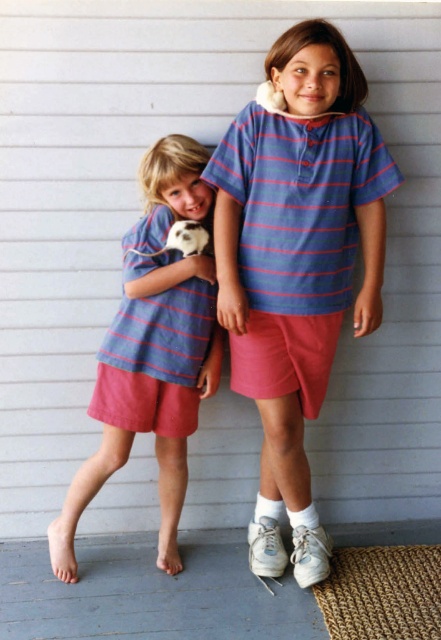
You are an artist trying to sketch the scene. You need to place the blue striped shirt at center in your drawing. According to the coordinates provided, where should you position it on your canvas?

The blue striped shirt at center should be positioned at coordinates point (296,260) on the canvas.